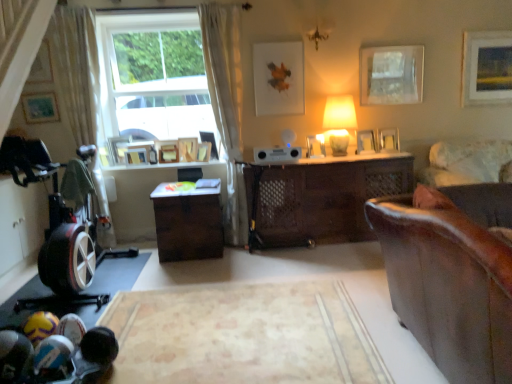
Identify the location of free space to the left of brown matte desk at center, placed as the 2th desk when sorted from right to left. This screenshot has width=512, height=384. (132, 259).